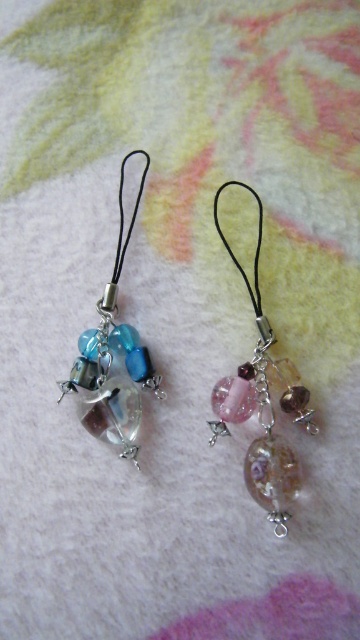
Question: Which point is closer to the camera?

Choices:
 (A) translucent glass charm at left
 (B) translucent pink glass charm at center

Answer: (B)

Question: Is the position of translucent pink glass charm at center less distant than that of translucent glass charm at left?

Choices:
 (A) yes
 (B) no

Answer: (A)

Question: Can you confirm if translucent pink glass charm at center is positioned to the left of translucent glass charm at left?

Choices:
 (A) no
 (B) yes

Answer: (A)

Question: Which point is closer to the camera taking this photo?

Choices:
 (A) (263, 403)
 (B) (118, 432)

Answer: (B)

Question: In this image, where is translucent pink glass charm at center located relative to translucent glass charm at left?

Choices:
 (A) right
 (B) left

Answer: (A)